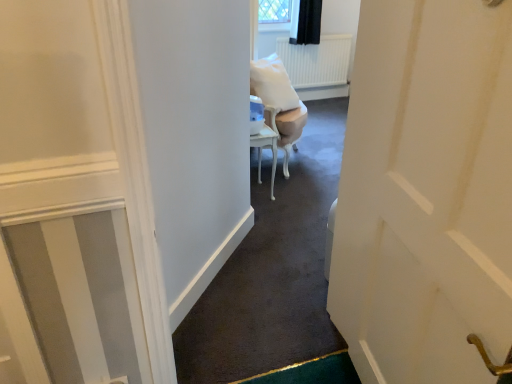
Find the location of a particular element. The height and width of the screenshot is (384, 512). free space below white glossy table at center (from a real-world perspective) is located at coordinates (258, 187).